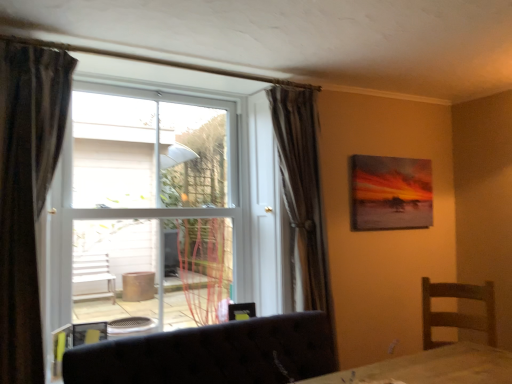
Question: Is silky brown curtain at center, which is counted as the 2th curtain, starting from the front, taller than dark fabric curtain at left, the first curtain from the front?

Choices:
 (A) no
 (B) yes

Answer: (B)

Question: Can you confirm if silky brown curtain at center, the first curtain positioned from the right, is positioned to the right of dark fabric curtain at left, which ranks as the second curtain in right-to-left order?

Choices:
 (A) no
 (B) yes

Answer: (B)

Question: Is silky brown curtain at center, which is the 2th curtain in left-to-right order, turned away from dark fabric curtain at left, the first curtain from the front?

Choices:
 (A) yes
 (B) no

Answer: (B)

Question: From the image's perspective, does silky brown curtain at center, which is the first curtain from back to front, appear lower than dark fabric curtain at left, the second curtain from the back?

Choices:
 (A) no
 (B) yes

Answer: (B)

Question: Is silky brown curtain at center, which is counted as the 2th curtain, starting from the front, to the left of dark fabric curtain at left, which ranks as the first curtain in left-to-right order, from the viewer's perspective?

Choices:
 (A) no
 (B) yes

Answer: (A)

Question: Considering the relative positions of dark fabric couch at lower center and white plastic window at center in the image provided, is dark fabric couch at lower center to the left or to the right of white plastic window at center?

Choices:
 (A) left
 (B) right

Answer: (B)

Question: From a real-world perspective, is dark fabric couch at lower center positioned above or below white plastic window at center?

Choices:
 (A) below
 (B) above

Answer: (A)

Question: From the image's perspective, is dark fabric couch at lower center above or below white plastic window at center?

Choices:
 (A) above
 (B) below

Answer: (B)

Question: Is dark fabric couch at lower center wider or thinner than white plastic window at center?

Choices:
 (A) thin
 (B) wide

Answer: (B)

Question: Is silky brown curtain at center, which is the first curtain from back to front, taller or shorter than matte canvas painting at upper right?

Choices:
 (A) short
 (B) tall

Answer: (B)

Question: Is silky brown curtain at center, which is the first curtain from back to front, to the left or to the right of matte canvas painting at upper right in the image?

Choices:
 (A) left
 (B) right

Answer: (A)

Question: Is silky brown curtain at center, which is the first curtain from back to front, in front of or behind matte canvas painting at upper right in the image?

Choices:
 (A) behind
 (B) front

Answer: (B)

Question: Considering the positions of point (300, 185) and point (381, 180), is point (300, 185) closer or farther from the camera than point (381, 180)?

Choices:
 (A) closer
 (B) farther

Answer: (A)

Question: In the image, is white plastic window at center positioned in front of or behind dark fabric curtain at left, which ranks as the first curtain in left-to-right order?

Choices:
 (A) behind
 (B) front

Answer: (A)

Question: From the image's perspective, is white plastic window at center positioned above or below dark fabric curtain at left, which ranks as the first curtain in left-to-right order?

Choices:
 (A) below
 (B) above

Answer: (B)